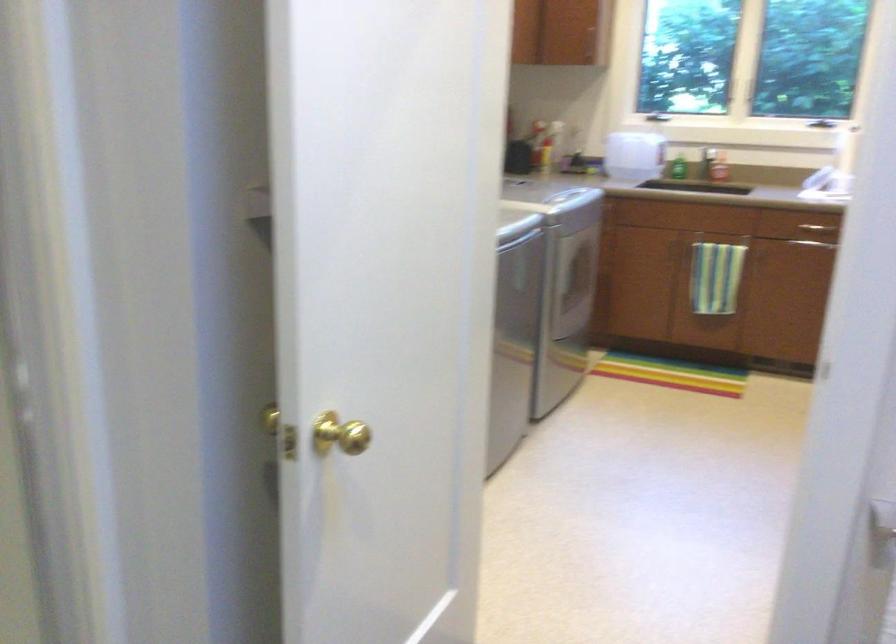
At what (x,y) coordinates should I click in order to perform the action: click on green soap bottle. Please return your answer as a coordinate pair (x, y). The image size is (896, 644). Looking at the image, I should click on (676, 167).